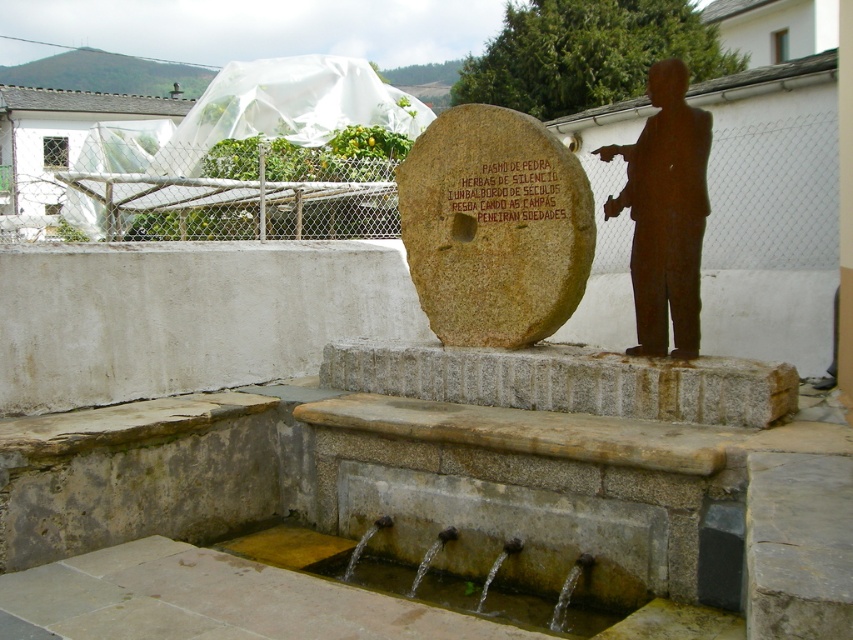
You are a visitor at the fountain and want to pour water onto the brown stone millstone at center from the clear water at fountain lower. Is this possible?

The brown stone millstone at center is above the clear water at fountain lower, so pouring water from the lower clear water onto the higher millstone would require lifting the water upwards, which isn

What is the 2D coordinate of the clear water at fountain lower in the image?

The 2D coordinate of the clear water at fountain lower is at point (466, 595).